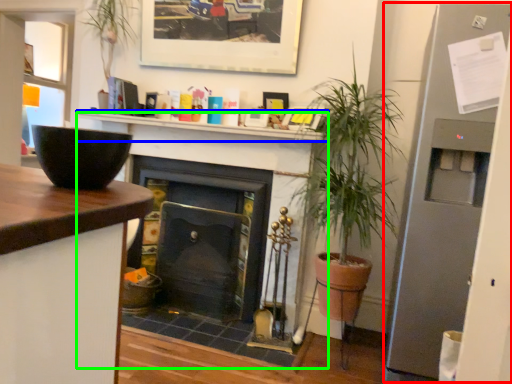
Question: Considering the real-world distances, which object is closest to fridge (highlighted by a red box)? shelf (highlighted by a blue box) or fireplace (highlighted by a green box).

Choices:
 (A) shelf
 (B) fireplace

Answer: (A)